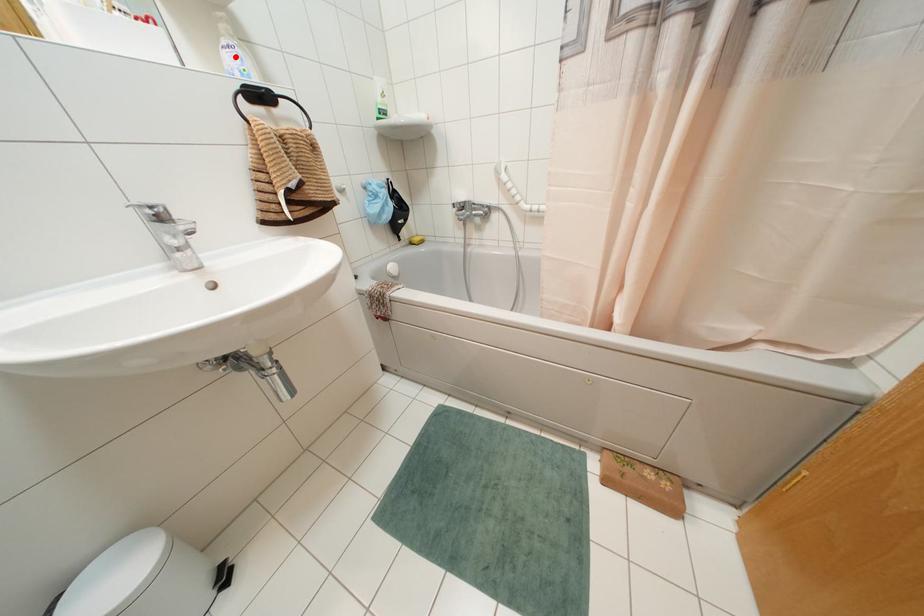
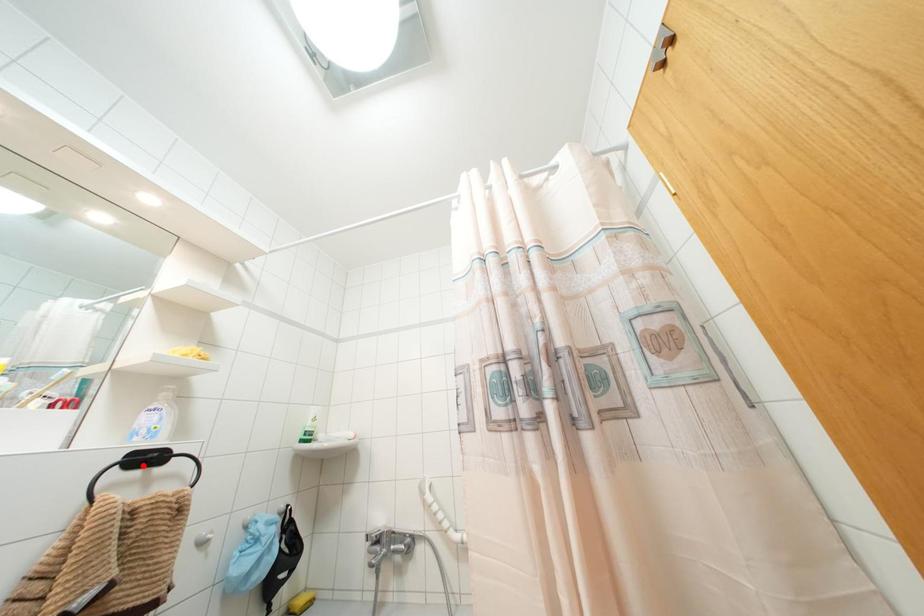
I am providing you with two images of the same scene from different viewpoints. A red point is marked on the first image and another point is marked on the second image. Do the highlighted points in image1 and image2 indicate the same real-world spot?

No